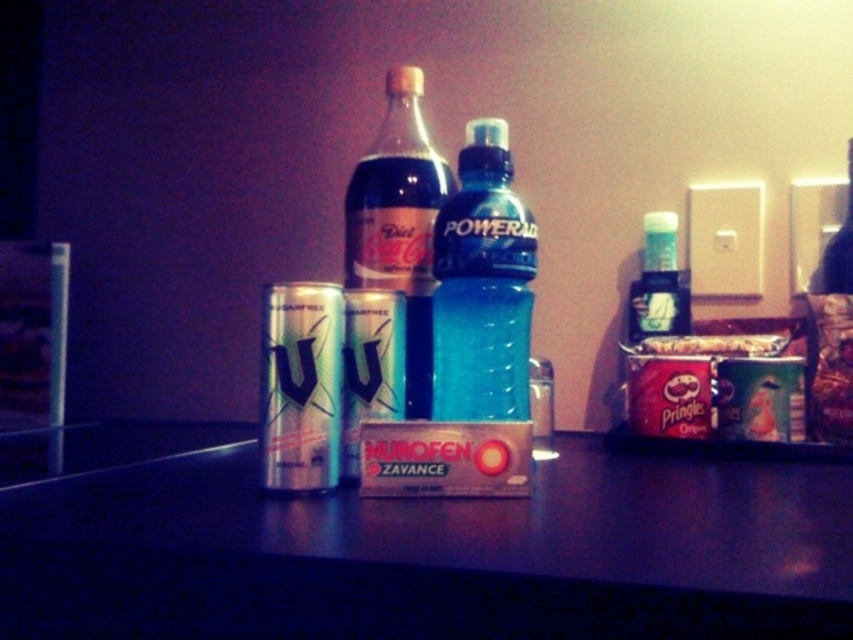
Question: Which point is closer to the camera?

Choices:
 (A) (450, 252)
 (B) (672, 252)
 (C) (33, 586)

Answer: (C)

Question: Which object is positioned closest to the blue translucent bottle at center?

Choices:
 (A) translucent plastic bottle at right
 (B) metallic silver table at center
 (C) diet coke glass bottle at center

Answer: (C)

Question: Which of the following is the closest to the observer?

Choices:
 (A) (462, 291)
 (B) (683, 333)

Answer: (A)

Question: Can you confirm if metallic silver table at center is wider than diet coke glass bottle at center?

Choices:
 (A) yes
 (B) no

Answer: (A)

Question: Is the position of metallic silver table at center more distant than that of diet coke glass bottle at center?

Choices:
 (A) no
 (B) yes

Answer: (A)

Question: Does blue translucent bottle at center have a greater width compared to translucent plastic bottle at right?

Choices:
 (A) no
 (B) yes

Answer: (B)